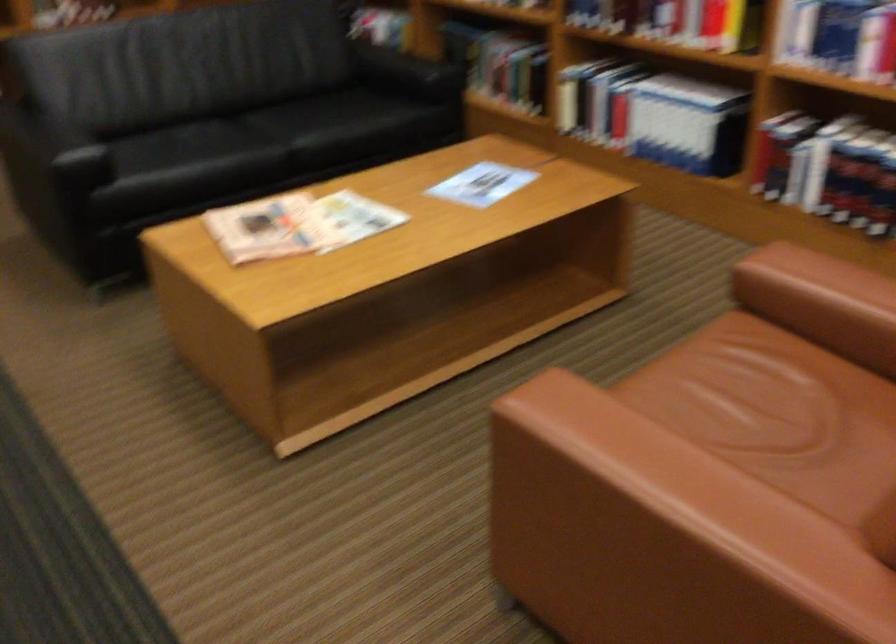
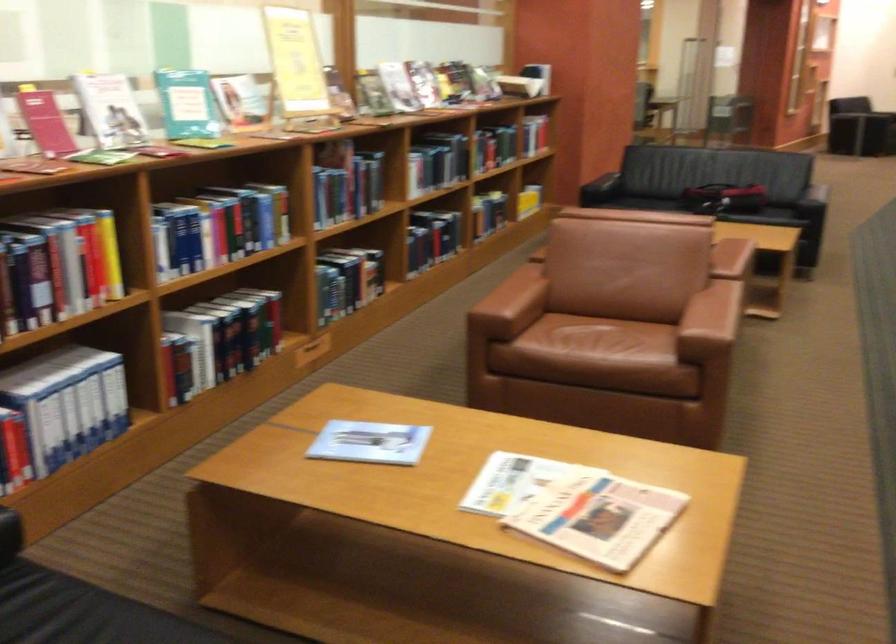
Where in the second image is the point corresponding to (x=640, y=109) from the first image?

(65, 404)